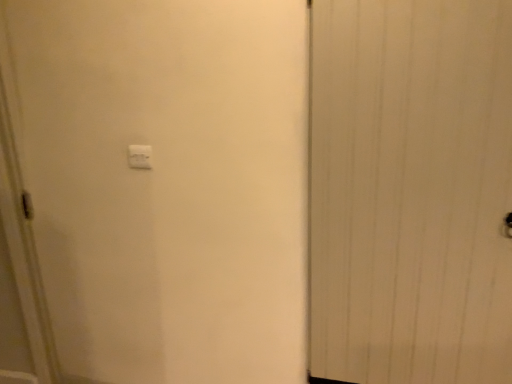
This screenshot has width=512, height=384. What do you see at coordinates (410, 191) in the screenshot?
I see `white wood door at right` at bounding box center [410, 191].

The image size is (512, 384). I want to click on white wood door at right, so coord(410,191).

What is the approximate width of white plastic light switch at upper center?

white plastic light switch at upper center is 0.76 inches in width.

The width and height of the screenshot is (512, 384). What do you see at coordinates (139, 156) in the screenshot? I see `white plastic light switch at upper center` at bounding box center [139, 156].

What is the approximate height of white plastic light switch at upper center?

9.84 centimeters.

Identify the location of white plastic light switch at upper center. The width and height of the screenshot is (512, 384). (139, 156).

Locate an element on the screen. Image resolution: width=512 pixels, height=384 pixels. white wood door at right is located at coordinates (410, 191).

Which object is positioned more to the right, white plastic light switch at upper center or white wood door at right?

white wood door at right.

Looking at this image, considering the positions of objects white plastic light switch at upper center and white wood door at right in the image provided, who is in front, white plastic light switch at upper center or white wood door at right?

white wood door at right is closer to the camera.

Which is farther from the camera, [129,163] or [421,331]?

The point [421,331] is farther from the camera.

From the image's perspective, is white plastic light switch at upper center beneath white wood door at right?

No.

From a real-world perspective, who is located higher, white plastic light switch at upper center or white wood door at right?

white plastic light switch at upper center is physically above.

Can you confirm if white plastic light switch at upper center is thinner than white wood door at right?

Indeed, white plastic light switch at upper center has a lesser width compared to white wood door at right.

Between white plastic light switch at upper center and white wood door at right, which one has less height?

With less height is white plastic light switch at upper center.

Can you confirm if white plastic light switch at upper center is bigger than white wood door at right?

No, white plastic light switch at upper center is not bigger than white wood door at right.

Would you say white wood door at right is part of white plastic light switch at upper center's contents?

No, white wood door at right is not a part of white plastic light switch at upper center.

Is white plastic light switch at upper center next to white wood door at right and touching it?

No, white plastic light switch at upper center is not making contact with white wood door at right.

Is white plastic light switch at upper center positioned with its back to white wood door at right?

That's not correct — white plastic light switch at upper center is not looking away from white wood door at right.

How many degrees apart are the facing directions of white plastic light switch at upper center and white wood door at right?

The angular difference between white plastic light switch at upper center and white wood door at right is 0.862 degrees.

Identify the location of light switch behind the white wood door at right. (139, 156).

Based on the photo, does white wood door at right appear on the right side of white plastic light switch at upper center?

Yes, white wood door at right is to the right of white plastic light switch at upper center.

Considering their positions, is white wood door at right located in front of or behind white plastic light switch at upper center?

Clearly, white wood door at right is in front of white plastic light switch at upper center.

Does point (497, 176) appear closer or farther from the camera than point (148, 150)?

Point (497, 176).

From the image's perspective, is white wood door at right on top of white plastic light switch at upper center?

No, from the image's perspective, white wood door at right is not over white plastic light switch at upper center.

From the picture: From a real-world perspective, is white wood door at right positioned over white plastic light switch at upper center based on gravity?

Actually, white wood door at right is physically below white plastic light switch at upper center in the real world.

Considering the sizes of objects white wood door at right and white plastic light switch at upper center in the image provided, who is thinner, white wood door at right or white plastic light switch at upper center?

With smaller width is white plastic light switch at upper center.

Can you confirm if white wood door at right is taller than white plastic light switch at upper center?

Indeed, white wood door at right has a greater height compared to white plastic light switch at upper center.

Considering the sizes of white wood door at right and white plastic light switch at upper center in the image, is white wood door at right bigger or smaller than white plastic light switch at upper center?

white wood door at right is bigger than white plastic light switch at upper center.

Could white plastic light switch at upper center be considered to be inside white wood door at right?

No.

Is white wood door at right touching white plastic light switch at upper center?

No.

Is white plastic light switch at upper center at the back of white wood door at right?

That's not correct — white wood door at right is not looking away from white plastic light switch at upper center.

Can you tell me how much white wood door at right and white plastic light switch at upper center differ in facing direction?

The angle between the facing direction of white wood door at right and the facing direction of white plastic light switch at upper center is 0.862 degrees.

Where is `door directly beneath the white plastic light switch at upper center (from a real-world perspective)`? door directly beneath the white plastic light switch at upper center (from a real-world perspective) is located at coordinates (410, 191).

Locate an element on the screen. The image size is (512, 384). door that is below the white plastic light switch at upper center (from the image's perspective) is located at coordinates (410, 191).

Locate an element on the screen. This screenshot has height=384, width=512. light switch located behind the white wood door at right is located at coordinates (139, 156).